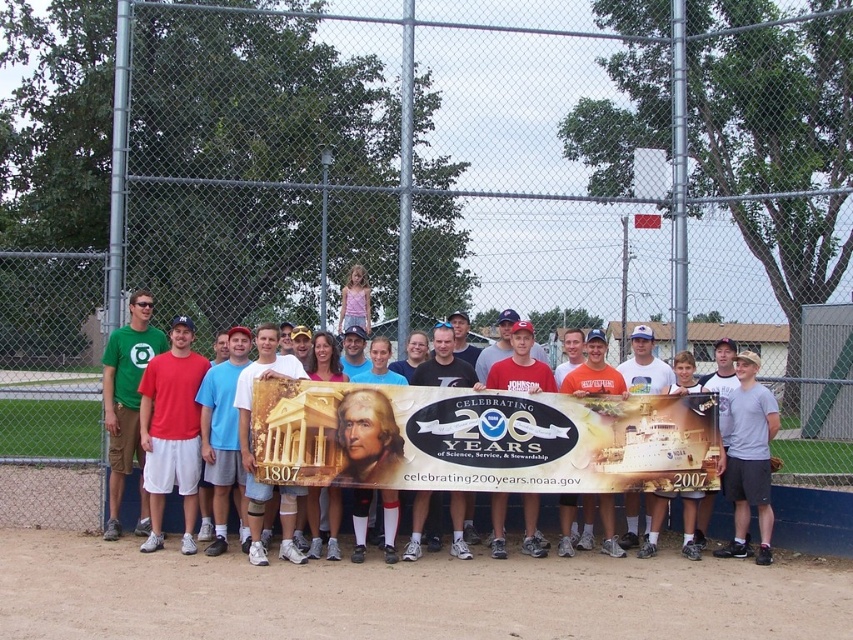
You are a photographer standing at the center of the field. You want to position yourself so that the matte white banner at center is exactly in the middle of your camera frame. Based on the banner location, where should you move? Please provide your answer in terms of direction and distance relative to the current position.

The matte white banner at center is located at point 0.680 on the x axis and 0.553 on the y axis. Since the photographer is currently at the center of the field, they should move to the left by 0.680 units and down by 0.553 units to center the banner in the frame.

You are standing at the position of the photographer who took the picture. You notice two points marked in the image. The first point is at coordinate point(x=431, y=448) and the second is at point(x=456, y=528). From your perspective, which point is closer to you?

Point(x=431, y=448) is in front of point(x=456, y=528), so it is closer to you.